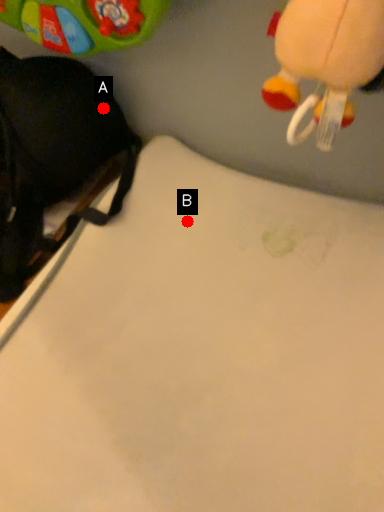
Question: Two points are circled on the image, labeled by A and B beside each circle. Which point appears closest to the camera in this image?

Choices:
 (A) A is closer
 (B) B is closer

Answer: (B)